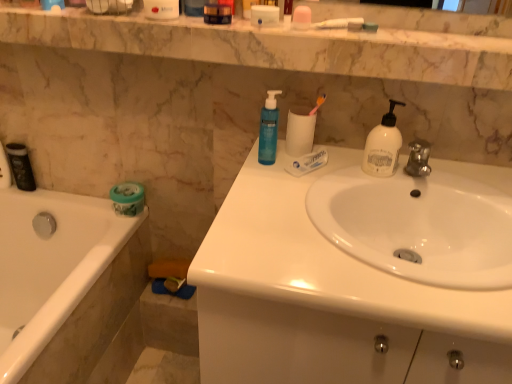
Question: Is point (267, 97) positioned closer to the camera than point (111, 190)?

Choices:
 (A) closer
 (B) farther

Answer: (A)

Question: Is blue translucent pump bottle at upper center, the 2th soap dispenser positioned from the right, inside the boundaries of green matte jar at lower left, the 2th toilet paper positioned from the top, or outside?

Choices:
 (A) inside
 (B) outside

Answer: (B)

Question: Estimate the real-world distances between objects in this image. Which object is closer to the white glossy bathtub at left?

Choices:
 (A) white matte toilet paper at center, which appears as the 1th toilet paper when viewed from the front
 (B) marble at upper center
 (C) black matte canister at left
 (D) white glossy sink at center, acting as the 1th sink starting from the top
 (E) blue translucent pump bottle at upper center, positioned as the first soap dispenser in left-to-right order

Answer: (C)

Question: Estimate the real-world distances between objects in this image. Which object is farther from the white glossy sink at center, positioned as the 2th sink in top-to-bottom order?

Choices:
 (A) marble at upper center
 (B) green matte jar at lower left, the first toilet paper in the back-to-front sequence
 (C) blue translucent pump bottle at upper center, the 2th soap dispenser positioned from the right
 (D) black matte canister at left
 (E) white glossy bathtub at left

Answer: (D)